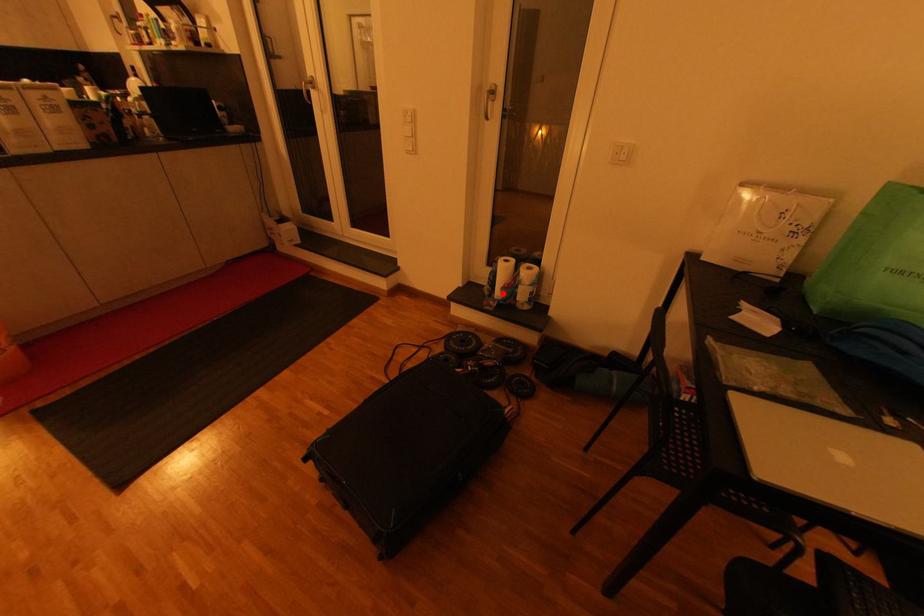
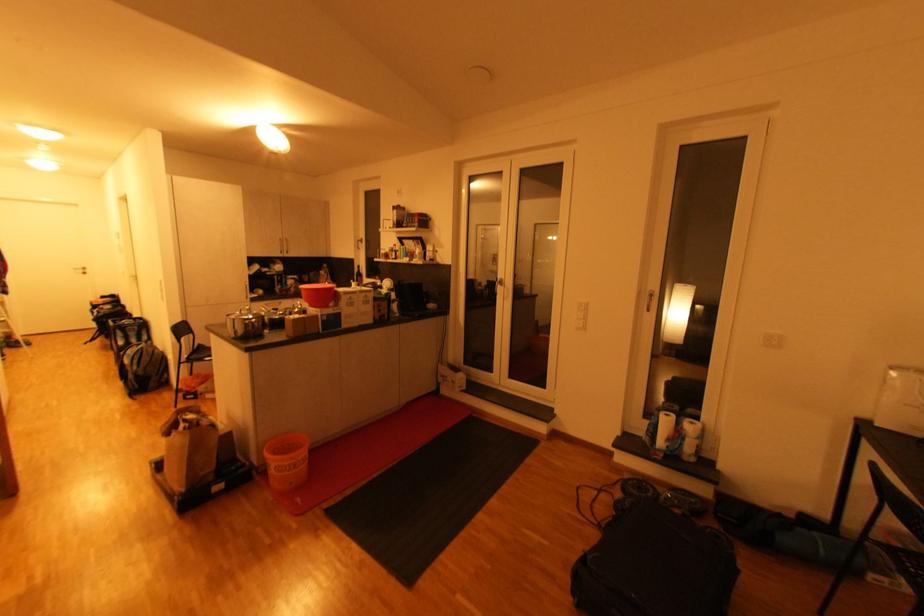
Where in the second image is the point corresponding to the highlighted location from the first image?

(665, 444)